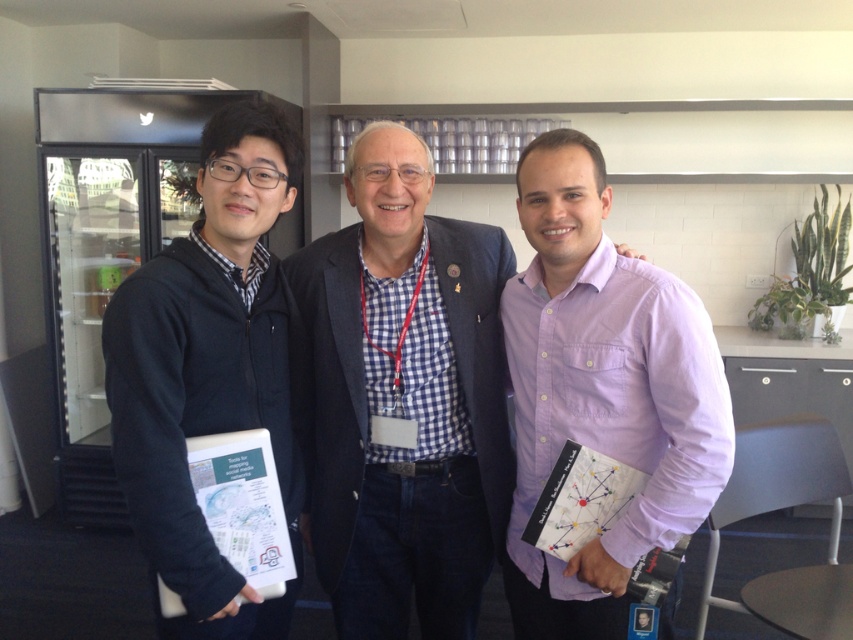
You are a photographer setting up a shoot in the office scene. You need to position a spotlight so that it illuminates the checkered fabric shirt at center and the purple cotton shirt at center. According to the scene description, which shirt should you aim the spotlight at first if you want to ensure both are lit without moving the light?

The checkered fabric shirt at center is located above the purple cotton shirt at center, so you should aim the spotlight at the checkered fabric shirt at center first. This way, the light will naturally cascade downward to also illuminate the purple cotton shirt at center without needing to adjust the position.

You are taking a photo of the three people in the office. You want to focus on the person closer to the camera. Which point should you focus on, point (407,180) or point (550,298)?

Point (407,180) is further to the camera than point (550,298), so you should focus on point (407,180) to capture the person closer to the camera.